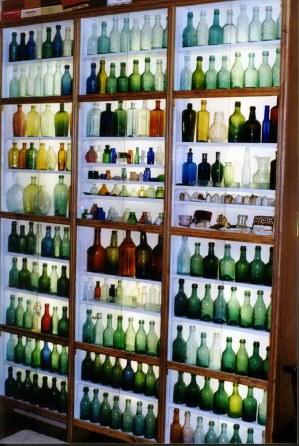
Find the location of `boxes on top of shelves`. boxes on top of shelves is located at coordinates (30, 12), (54, 9), (12, 13).